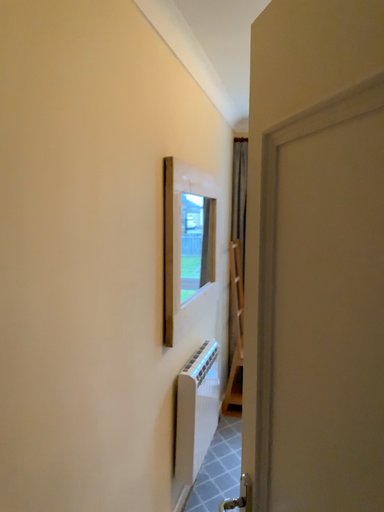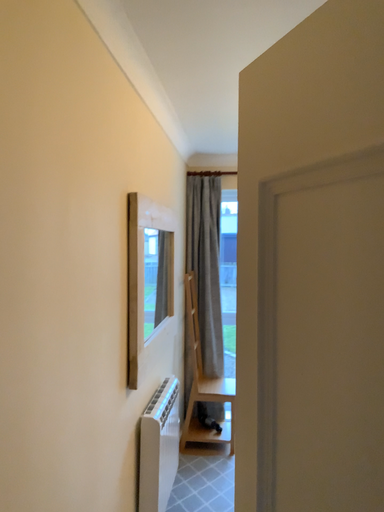
Question: How did the camera likely rotate when shooting the video?

Choices:
 (A) rotated right
 (B) rotated left

Answer: (A)